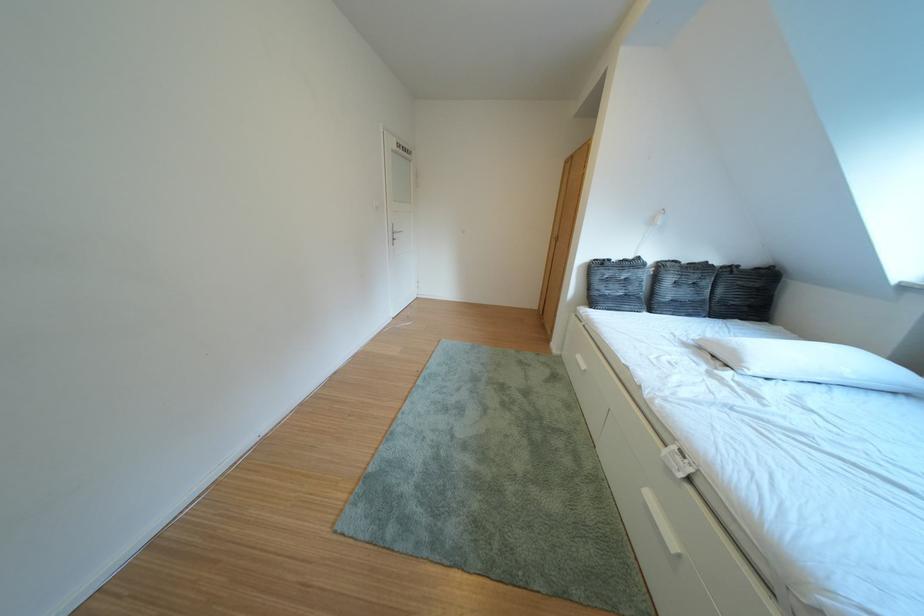
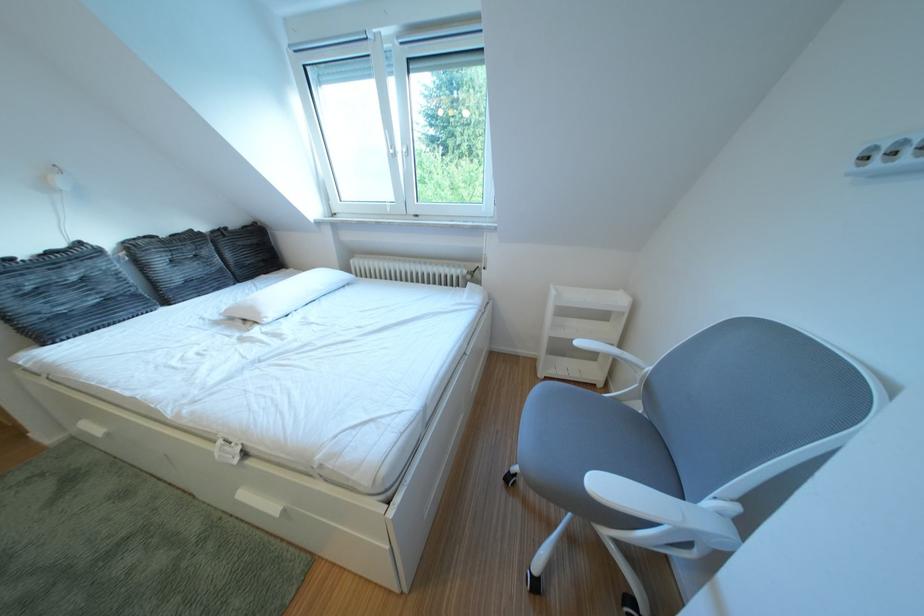
Locate, in the second image, the point that corresponds to the point at 699,267 in the first image.

(176, 240)